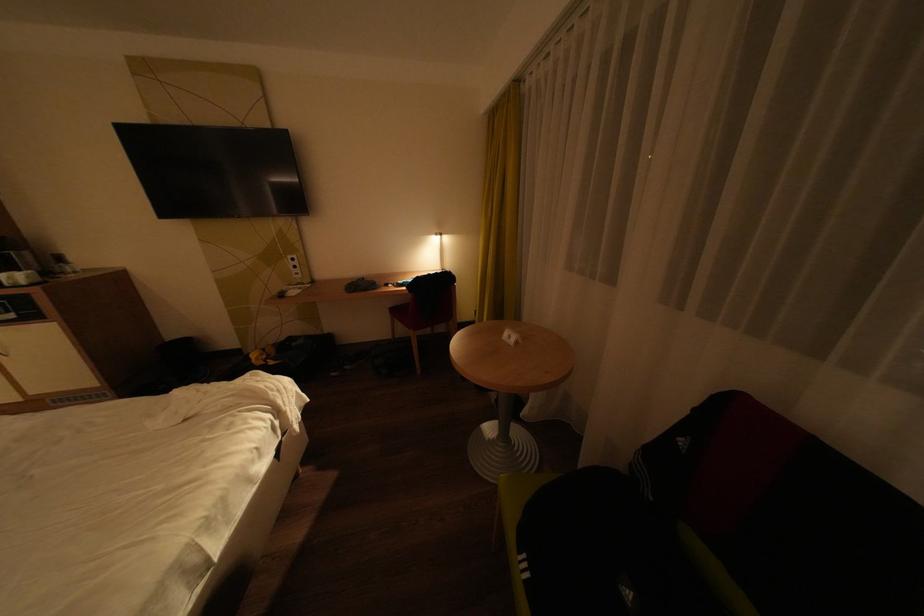
The location [511,336] corresponds to which object?

It refers to a small white card.